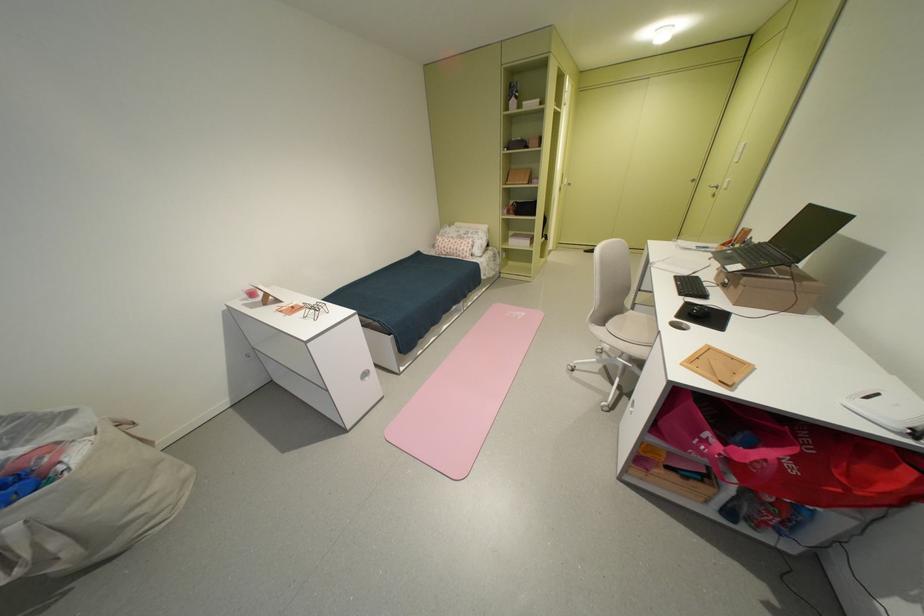
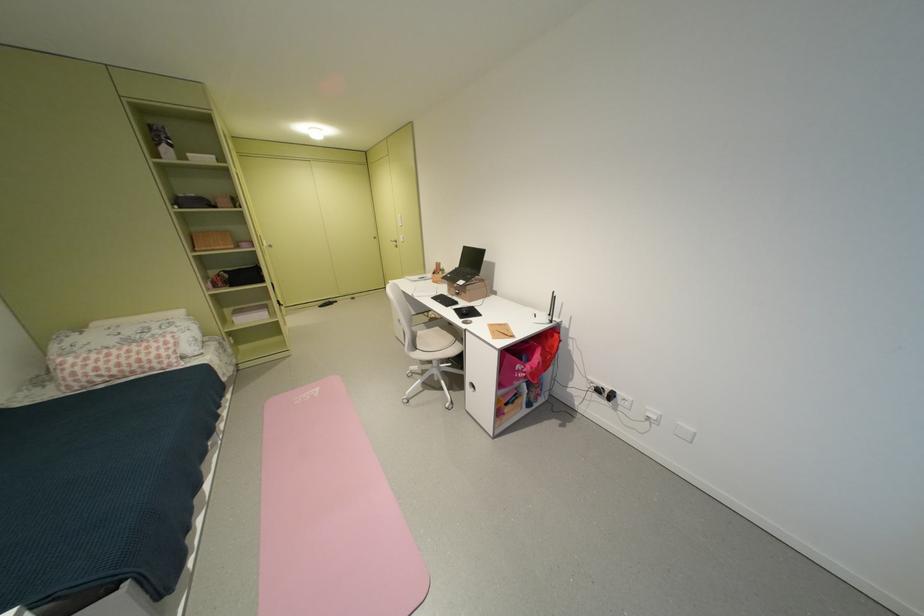
Find the pixel in the second image that matches point (888, 395) in the first image.

(544, 315)